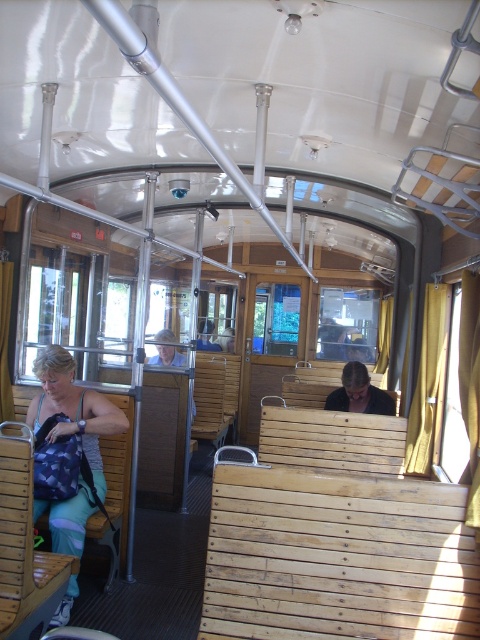
You are a passenger in the vintage tram and want to place your matte blue backpack at left on the floor. The tram has a maximum load capacity of 100 kg per square meter. If your backpack weighs 10 kg, what is the minimum area in square meters required to safely place it without exceeding the load limit?

The minimum area required is 0.1 square meters because 10 kg divided by 100 kg per square meter equals 0.1.

From the picture: You are a passenger in the vintage tram and need to retrieve your matte blue backpack at left and dark brown leather jacket at center. Which item is easier to reach without moving from your current seat?

The matte blue backpack at left is closer to the viewer than the dark brown leather jacket at center, so it is easier to reach without moving from your current seat.